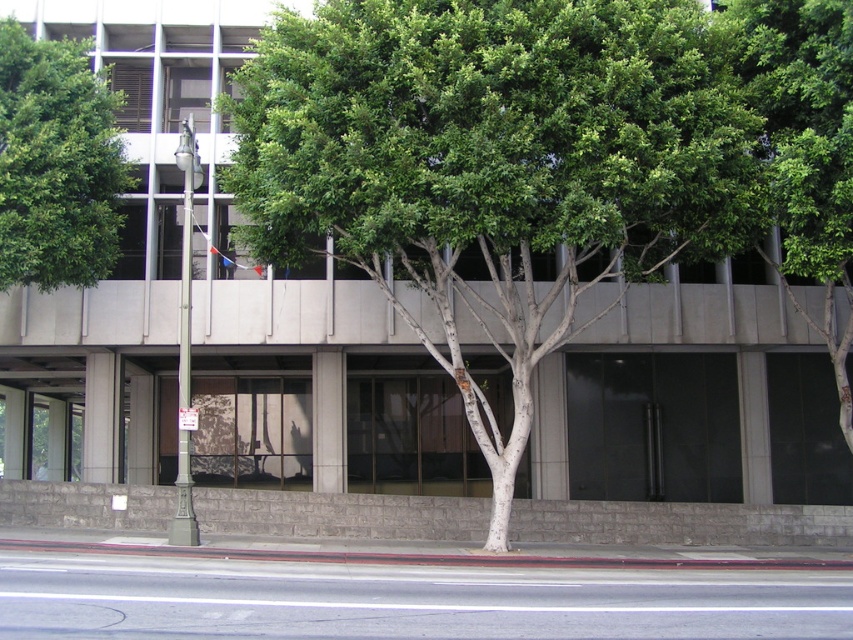
Question: Which point is closer to the camera taking this photo?

Choices:
 (A) (93, 122)
 (B) (817, 189)
 (C) (451, 337)

Answer: (B)

Question: Is green leafy tree at upper center below green leafy tree at upper left?

Choices:
 (A) no
 (B) yes

Answer: (B)

Question: Which object is the closest to the green leafy tree at center?

Choices:
 (A) green leafy tree at upper left
 (B) green leafy tree at upper center

Answer: (A)

Question: Does green leafy tree at center appear under green leafy tree at upper center?

Choices:
 (A) yes
 (B) no

Answer: (B)

Question: Considering the real-world distances, which object is farthest from the green leafy tree at upper center?

Choices:
 (A) green leafy tree at upper left
 (B) green leafy tree at center

Answer: (A)

Question: Is green leafy tree at center closer to camera compared to green leafy tree at upper left?

Choices:
 (A) yes
 (B) no

Answer: (A)